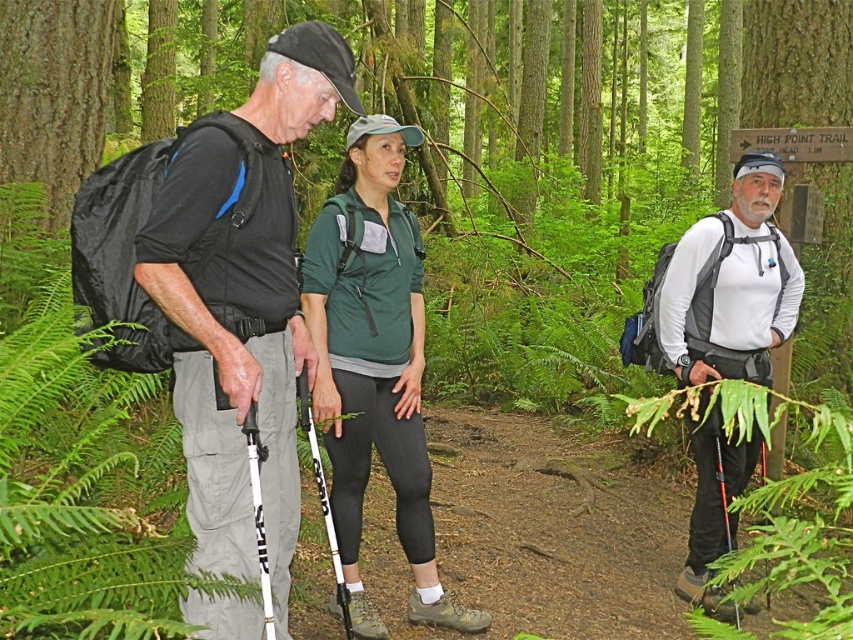
Can you confirm if green leafy fern at left is bigger than green fabric shirt at center?

Yes, green leafy fern at left is bigger than green fabric shirt at center.

Does point (32, 483) come farther from viewer compared to point (392, 225)?

No, (32, 483) is closer to viewer.

You are a GUI agent. You are given a task and a screenshot of the screen. Output one action in this format:
    pyautogui.click(x=<x>, y=<y>)
    Task: Click on the green leafy fern at left
    
    Given the screenshot: What is the action you would take?
    pyautogui.click(x=80, y=464)

Who is lower down, black matte backpack at left or white matte shirt at center?

white matte shirt at center is below.

Is black matte backpack at left to the right of white matte shirt at center from the viewer's perspective?

Incorrect, black matte backpack at left is not on the right side of white matte shirt at center.

Who is more forward, (x=242, y=228) or (x=747, y=356)?

Point (x=242, y=228)

Where is `black matte backpack at left`? The width and height of the screenshot is (853, 640). black matte backpack at left is located at coordinates (242, 305).

Does green leafy fern at left have a lesser width compared to white matte shirt at center?

In fact, green leafy fern at left might be wider than white matte shirt at center.

From the picture: Who is lower down, green leafy fern at left or white matte shirt at center?

green leafy fern at left is lower down.

Identify the location of green leafy fern at left. This screenshot has width=853, height=640. 80,464.